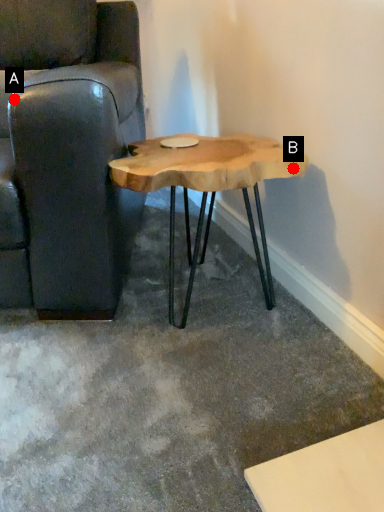
Question: Two points are circled on the image, labeled by A and B beside each circle. Which point appears farthest from the camera in this image?

Choices:
 (A) A is further
 (B) B is further

Answer: (B)